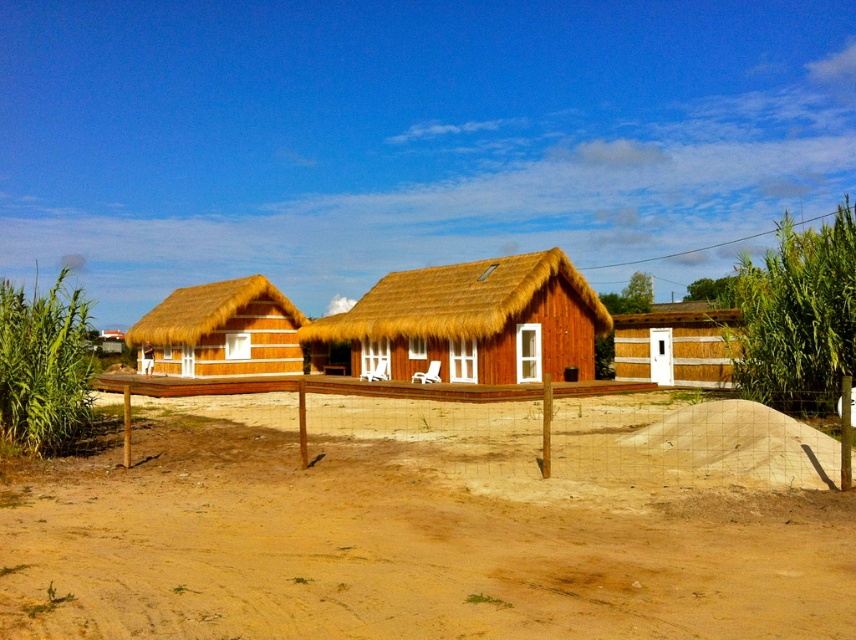
Is point (401, 280) closer to viewer compared to point (201, 292)?

Yes, it is.

Who is more distant from viewer, (544, 328) or (269, 368)?

The point (269, 368) is behind.

The height and width of the screenshot is (640, 856). In order to click on wooden hut at center in this screenshot , I will do `click(474, 317)`.

Which of these two, brown sandy dirt field at lower center or wooden fence at center, stands shorter?

Standing shorter between the two is brown sandy dirt field at lower center.

Does brown sandy dirt field at lower center appear on the left side of wooden fence at center?

No, brown sandy dirt field at lower center is not to the left of wooden fence at center.

Where is `brown sandy dirt field at lower center`? brown sandy dirt field at lower center is located at coordinates (434, 522).

Who is positioned more to the left, wooden hut at center or white wooden hut at center?

Positioned to the left is wooden hut at center.

Is wooden hut at center shorter than white wooden hut at center?

In fact, wooden hut at center may be taller than white wooden hut at center.

Locate an element on the screen. This screenshot has width=856, height=640. wooden hut at center is located at coordinates (474, 317).